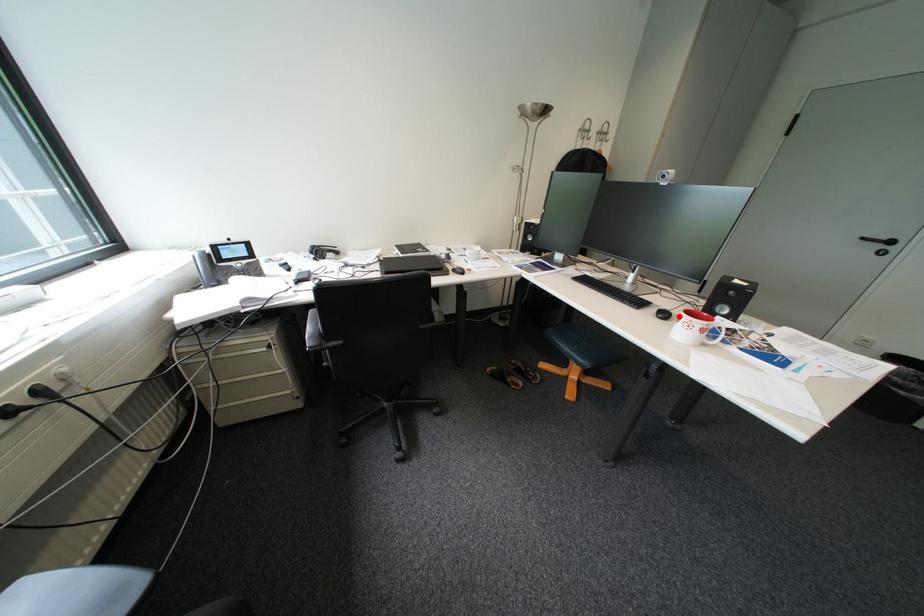
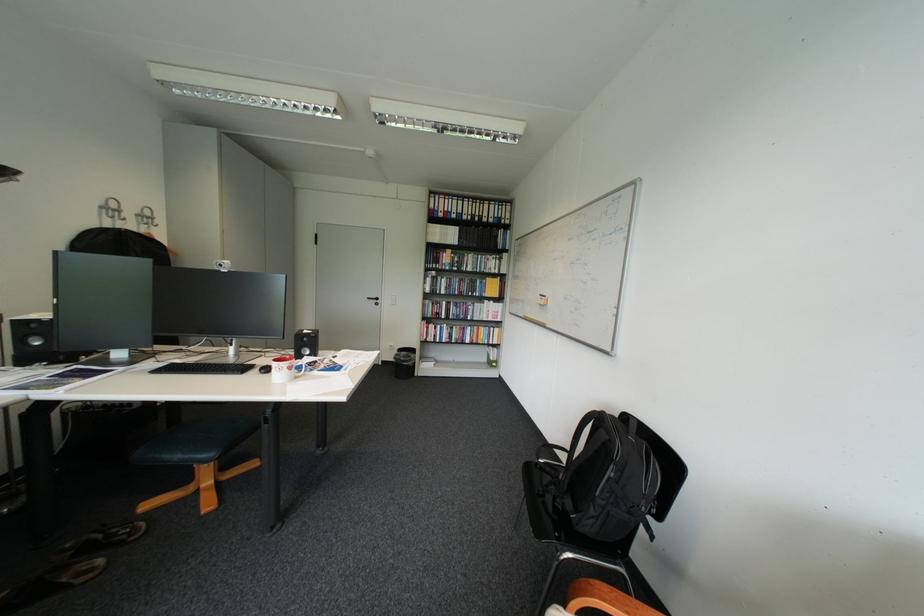
Find the pixel in the second image that matches the highlighted location in the first image.

(281, 370)